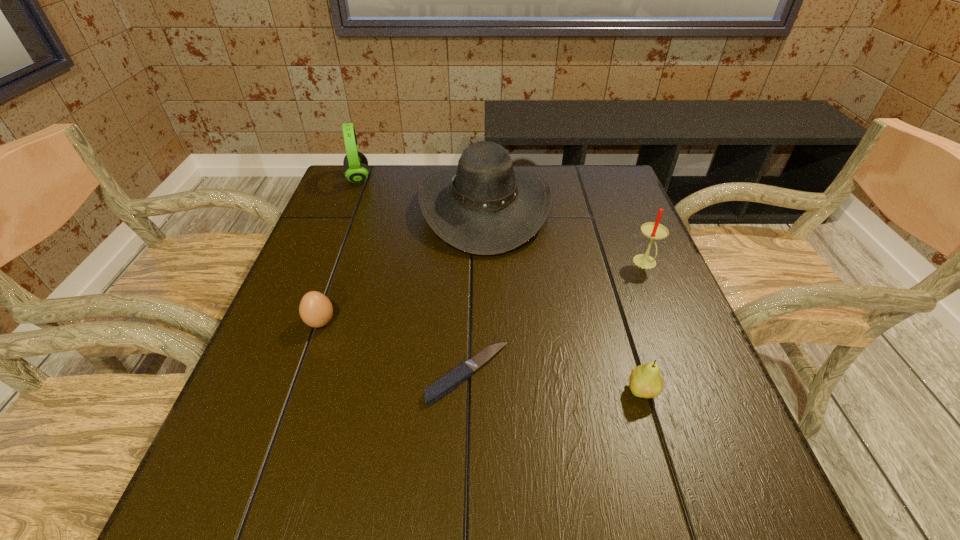
Find the location of `headset`. headset is located at coordinates (356, 170).

This screenshot has width=960, height=540. I want to click on cowboy hat, so click(x=485, y=207).

You are a GUI agent. You are given a task and a screenshot of the screen. Output one action in this format:
    pyautogui.click(x=<x>, y=<y>)
    Task: Click on the rightmost object
    The width and height of the screenshot is (960, 540).
    Given the screenshot: What is the action you would take?
    pyautogui.click(x=652, y=230)

At what (x,y) coordinates should I click in order to perform the action: click on pear. Please return your answer as a coordinate pair (x, y). Looking at the image, I should click on (645, 381).

Where is `the third nearest object`? the third nearest object is located at coordinates (316, 310).

At what (x,y) coordinates should I click in order to perform the action: click on the shortest object. Please return your answer as a coordinate pair (x, y). The height and width of the screenshot is (540, 960). Looking at the image, I should click on (450, 381).

The height and width of the screenshot is (540, 960). Find the location of `vacant space located 0.340m on the right of the headset`. vacant space located 0.340m on the right of the headset is located at coordinates (483, 178).

I want to click on free space located 0.170m on the front-facing side of the cowboy hat, so click(360, 208).

Identify the location of free space located on the front-facing side of the cowboy hat. The height and width of the screenshot is (540, 960). (396, 208).

Locate an element on the screen. vacant area situated on the front-facing side of the cowboy hat is located at coordinates (367, 208).